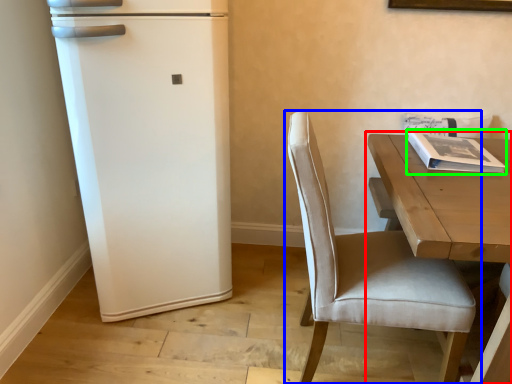
Question: Which is farther away from table (highlighted by a red box)? chair (highlighted by a blue box) or magazine (highlighted by a green box)?

Choices:
 (A) chair
 (B) magazine

Answer: (A)